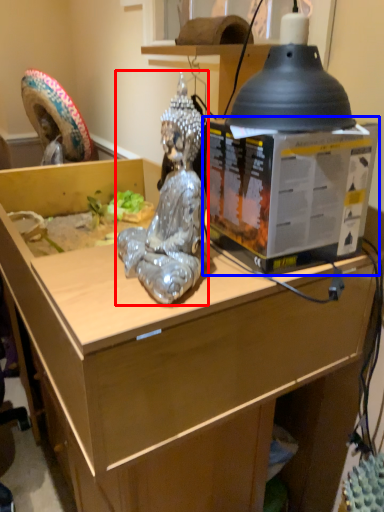
Question: Among these objects, which one is farthest to the camera, person (highlighted by a red box) or box (highlighted by a blue box)?

Choices:
 (A) person
 (B) box

Answer: (B)